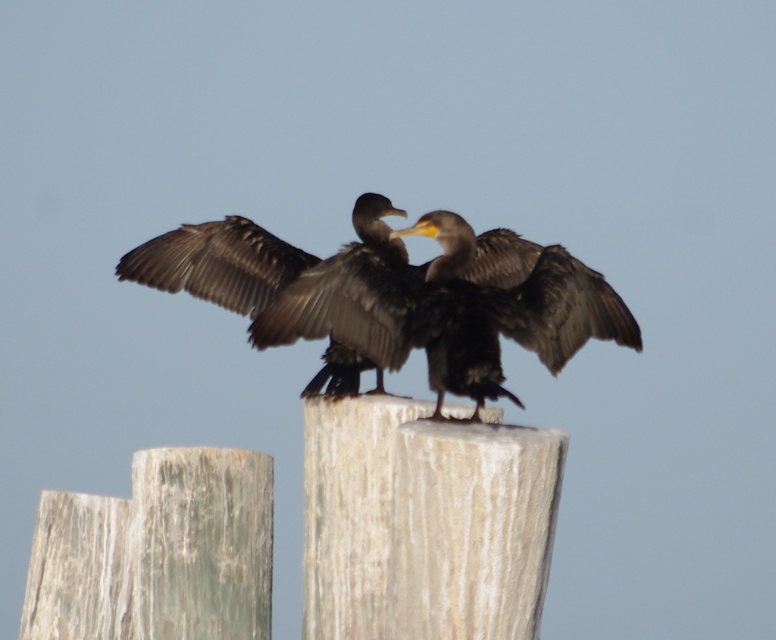
Question: Does white textured post at center appear on the left side of dark brown feathers at center?

Choices:
 (A) yes
 (B) no

Answer: (A)

Question: Can you confirm if white textured post at center is bigger than brown feathered bird at center?

Choices:
 (A) yes
 (B) no

Answer: (A)

Question: Which point appears farthest from the camera in this image?

Choices:
 (A) (431, 269)
 (B) (369, 234)
 (C) (366, 448)

Answer: (B)

Question: Which object is positioned farthest from the white textured post at center?

Choices:
 (A) brown feathered bird at center
 (B) dark brown feathers at center

Answer: (A)

Question: Which point is closer to the camera?

Choices:
 (A) (501, 465)
 (B) (560, 273)
 (C) (175, 262)

Answer: (A)

Question: Is dark brown feathers at center in front of brown feathered bird at center?

Choices:
 (A) no
 (B) yes

Answer: (B)